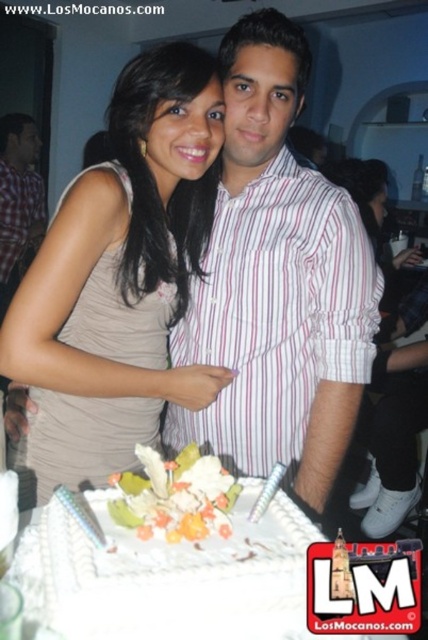
Between point (187, 429) and point (83, 548), which one is positioned behind?

The point (187, 429) is more distant.

Is point (330, 243) positioned in front of point (88, 586)?

No, (330, 243) is behind (88, 586).

At what (x,y) coordinates should I click in order to perform the action: click on pink striped shirt at center. Please return your answer as a coordinate pair (x, y). This screenshot has height=640, width=428. Looking at the image, I should click on (278, 282).

This screenshot has width=428, height=640. Describe the element at coordinates (121, 275) in the screenshot. I see `matte beige dress at center` at that location.

Is matte beige dress at center bigger than white frosted cake at center?

Yes.

Locate an element on the screen. matte beige dress at center is located at coordinates (121, 275).

Can you confirm if pink striped shirt at center is bigger than checkered fabric shirt at left?

Yes, pink striped shirt at center is bigger than checkered fabric shirt at left.

Which is in front, point (276, 64) or point (23, 182)?

Point (276, 64) is more forward.

At what (x,y) coordinates should I click in order to perform the action: click on pink striped shirt at center. Please return your answer as a coordinate pair (x, y). Looking at the image, I should click on (278, 282).